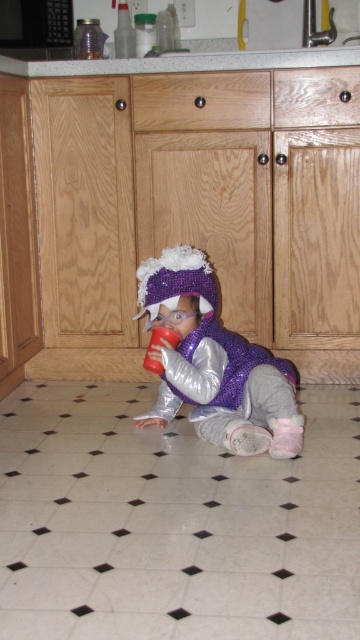
You are a delivery robot in a kitchen. You need to deliver a package to the point at coordinates point (276, 442). Your current position is at point (173, 54). According to the scene, which direction should you move to reach the destination?

Point (276, 442) is in front of point (173, 54), so the delivery robot should move forward to reach the destination.